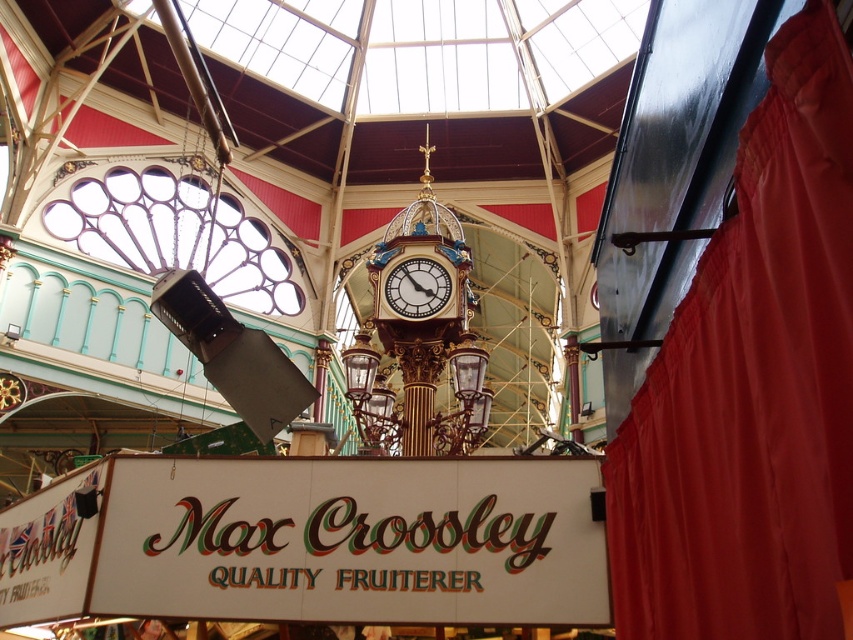
Question: Is red velvet curtain at right above gold metallic clock at center?

Choices:
 (A) yes
 (B) no

Answer: (B)

Question: Is red velvet curtain at right wider than gold metallic clock at center?

Choices:
 (A) no
 (B) yes

Answer: (A)

Question: Can you confirm if red velvet curtain at right is wider than gold metallic clock at center?

Choices:
 (A) no
 (B) yes

Answer: (A)

Question: Among these points, which one is farthest from the camera?

Choices:
 (A) (422, 262)
 (B) (787, 166)

Answer: (A)

Question: Among these points, which one is nearest to the camera?

Choices:
 (A) (422, 284)
 (B) (836, 572)

Answer: (B)